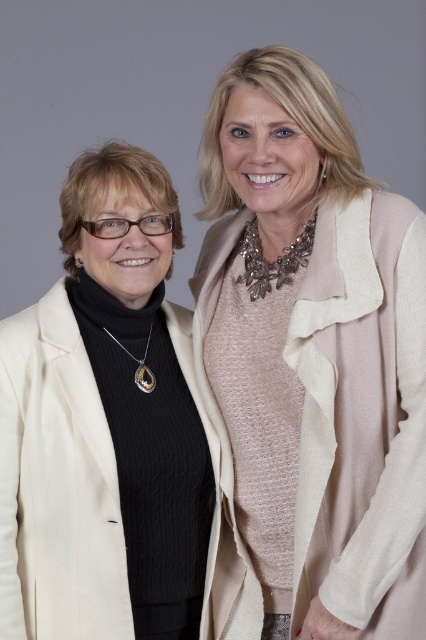
Can you confirm if matte black turtleneck sweater at left is positioned above beige textured coat at upper right?

Yes, matte black turtleneck sweater at left is above beige textured coat at upper right.

Between matte black turtleneck sweater at left and beige textured coat at upper right, which one appears on the right side from the viewer's perspective?

beige textured coat at upper right is more to the right.

Which is in front, point (95, 241) or point (403, 376)?

Point (403, 376) is more forward.

This screenshot has height=640, width=426. In order to click on matte black turtleneck sweater at left in this screenshot , I will do `click(104, 426)`.